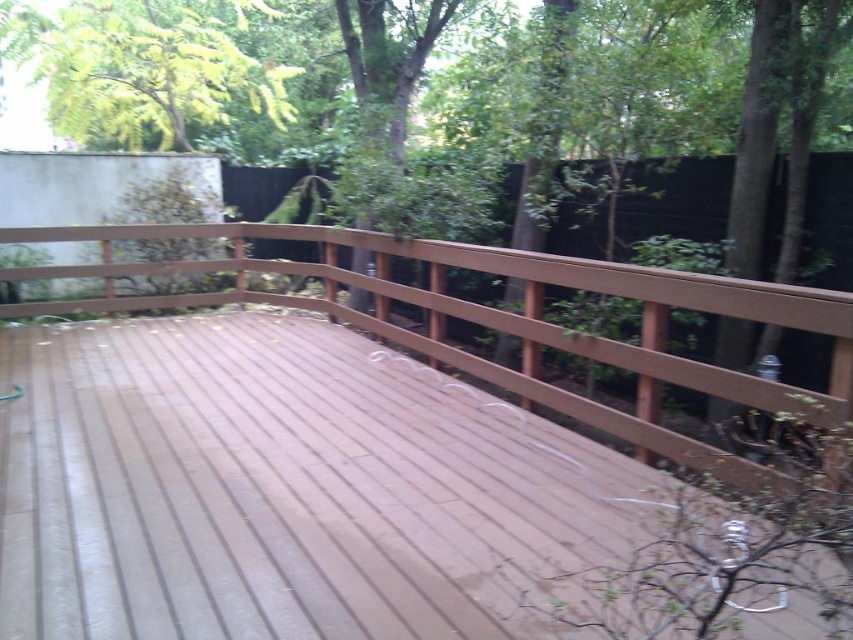
Does point (166, 625) lie in front of point (711, 307)?

Yes, point (166, 625) is closer to viewer.

Find the location of a particular element. satin wood deck at center is located at coordinates (497, 321).

Does satin wood deck at center have a smaller size compared to yellow-green leaves at upper left?

Correct, satin wood deck at center occupies less space than yellow-green leaves at upper left.

Is the position of satin wood deck at center more distant than that of yellow-green leaves at upper left?

That is False.

Is point (335, 513) farther from viewer compared to point (282, 86)?

No, it is not.

This screenshot has height=640, width=853. Find the location of `satin wood deck at center`. satin wood deck at center is located at coordinates (497, 321).

Between yellow-green leaves at upper left and brown wooden deck at center, which one is positioned higher?

yellow-green leaves at upper left is above.

Is yellow-green leaves at upper left bigger than brown wooden deck at center?

Yes.

Which is behind, point (247, 58) or point (581, 276)?

Positioned behind is point (247, 58).

Identify the location of yellow-green leaves at upper left. (143, 67).